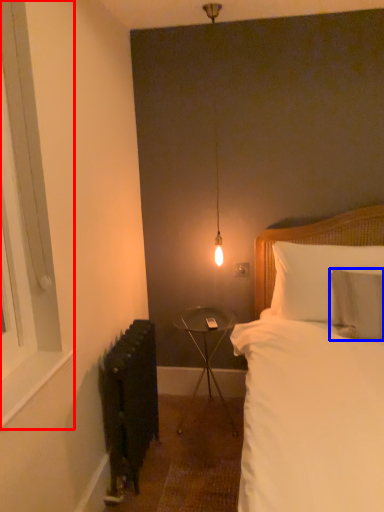
Question: Among these objects, which one is farthest to the camera, window (highlighted by a red box) or pillow (highlighted by a blue box)?

Choices:
 (A) window
 (B) pillow

Answer: (B)